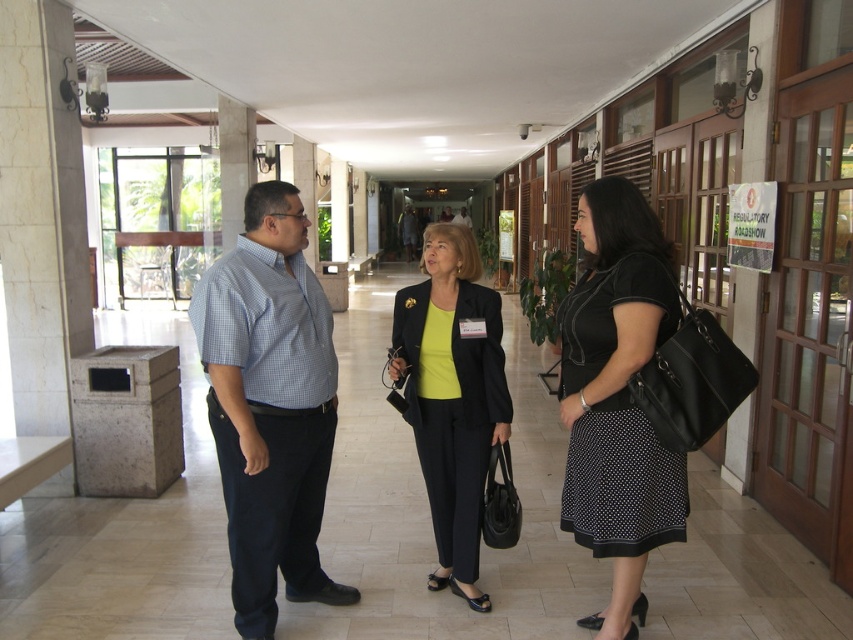
You are a photographer trying to capture a candid shot of the blue checkered shirt at center and the black dotted skirt at center. Since the two are at the same location, which one is closer to the camera?

The blue checkered shirt at center is positioned under the black dotted skirt at center, so it is closer to the camera.

You are a photographer trying to capture a group photo of the blue checkered shirt at center and the black dotted skirt at center. Since you want to ensure both subjects are fully visible, which subject should you position closer to the camera to avoid being blocked?

The black dotted skirt at center is behind the blue checkered shirt at center, so to ensure both are fully visible, position the blue checkered shirt at center closer to the camera so that the black dotted skirt at center isn not blocked.

You are organizing a photo shoot and need to place a backdrop behind the two central figures. The backdrop is 1.5 meters wide. Given the sizes of the blue checkered shirt at center and the matte black blazer at center, will the backdrop be wide enough to cover both figures without overlapping?

The blue checkered shirt at center is smaller than the matte black blazer at center. However, the total width required to cover both figures cannot be determined from the given information. The answer is inconclusive based on the provided data.